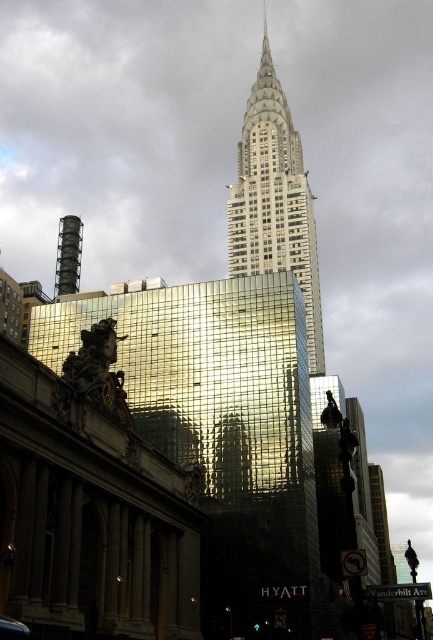
Question: Considering the relative positions of gold reflective glass building at center and white marble tower at upper center in the image provided, where is gold reflective glass building at center located with respect to white marble tower at upper center?

Choices:
 (A) above
 (B) below

Answer: (B)

Question: Can you confirm if gold reflective glass building at center is smaller than white marble tower at upper center?

Choices:
 (A) yes
 (B) no

Answer: (A)

Question: Which point is closer to the camera taking this photo?

Choices:
 (A) (303, 234)
 (B) (232, 468)

Answer: (B)

Question: Can you confirm if gold reflective glass building at center is thinner than white marble tower at upper center?

Choices:
 (A) no
 (B) yes

Answer: (A)